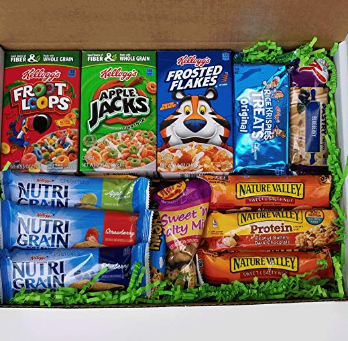
Locate an element on the screen. This screenshot has height=341, width=348. breakfast bars is located at coordinates (100, 196), (85, 224), (90, 276), (275, 186), (270, 228), (272, 270), (310, 128).